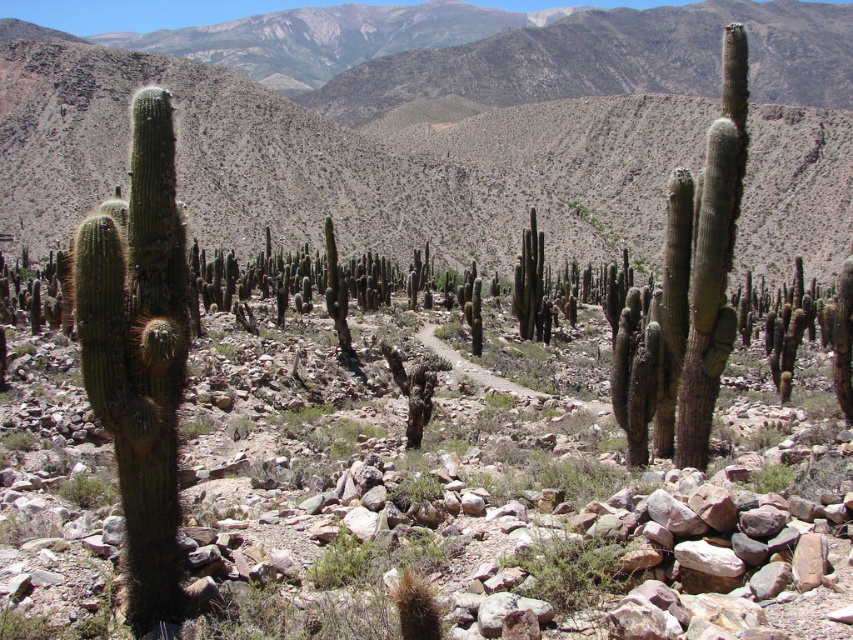
Between point (416, 124) and point (91, 323), which one is positioned behind?

Positioned behind is point (416, 124).

Between point (392, 204) and point (123, 497), which one is positioned behind?

The point (392, 204) is more distant.

Locate an element on the screen. This screenshot has height=640, width=853. green textured mountain range at upper center is located at coordinates (428, 156).